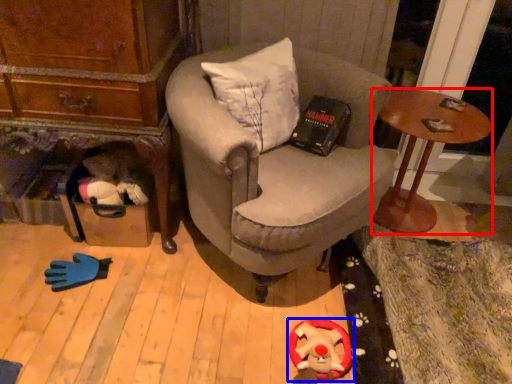
Question: Which object is further to the camera taking this photo, desk (highlighted by a red box) or toy (highlighted by a blue box)?

Choices:
 (A) desk
 (B) toy

Answer: (A)